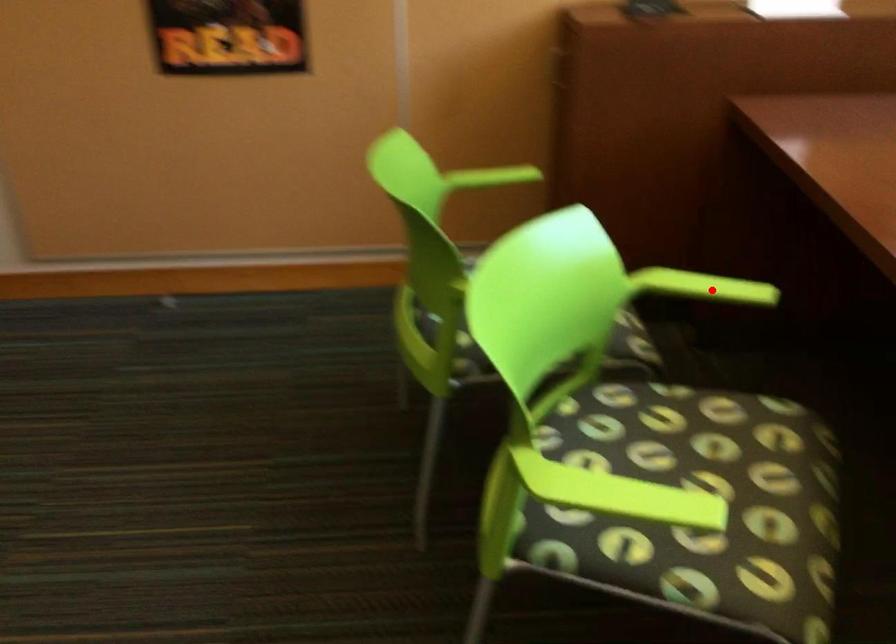
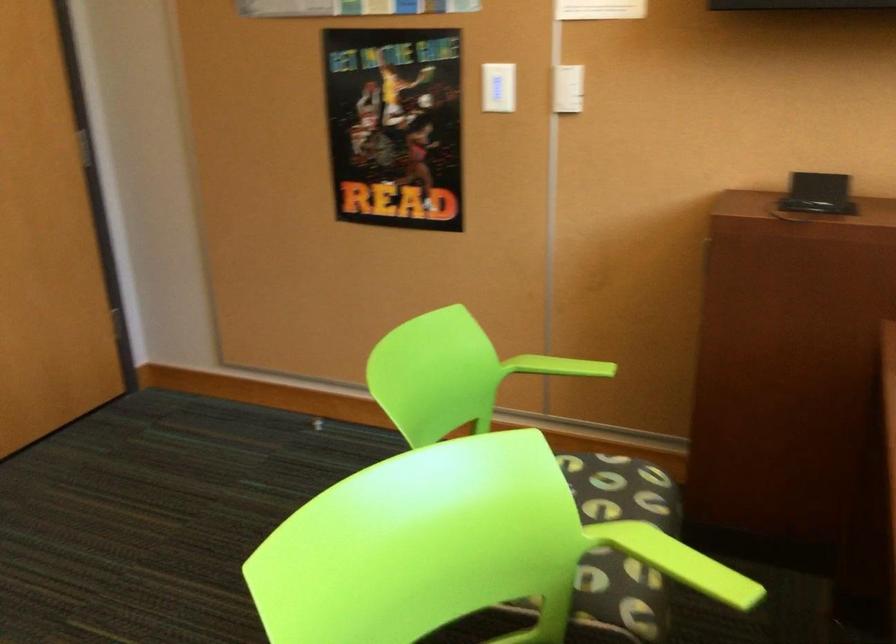
The point at the highlighted location is marked in the first image. Where is the corresponding point in the second image?

(685, 564)